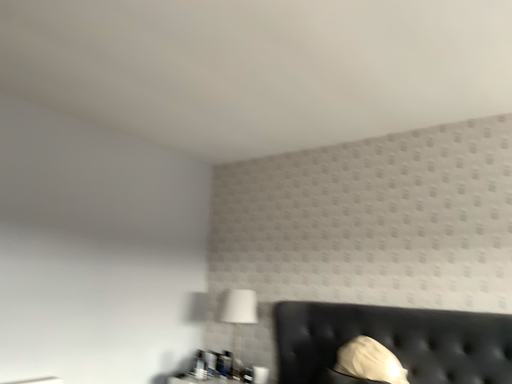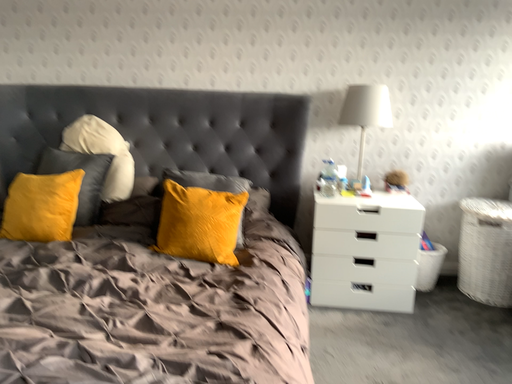
Question: How did the camera likely rotate when shooting the video?

Choices:
 (A) rotated upward
 (B) rotated downward

Answer: (B)